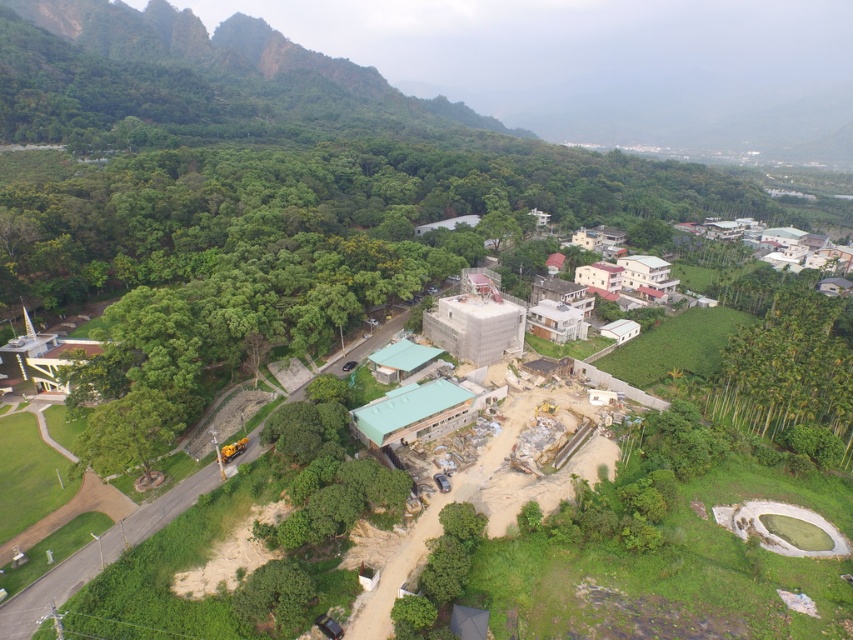
Is point (709, 394) closer to camera compared to point (572, 243)?

That is True.

Between point (753, 326) and point (637, 262), which one is positioned in front?

Positioned in front is point (753, 326).

Is point (805, 285) positioned after point (579, 284)?

Yes, point (805, 285) is farther from viewer.

Locate an element on the screen. green leafy trees at lower right is located at coordinates (788, 369).